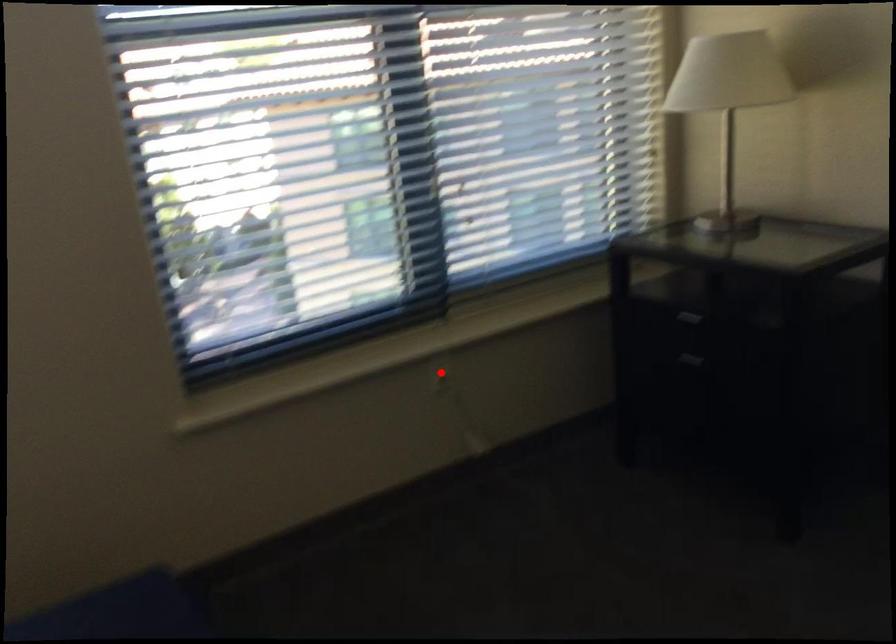
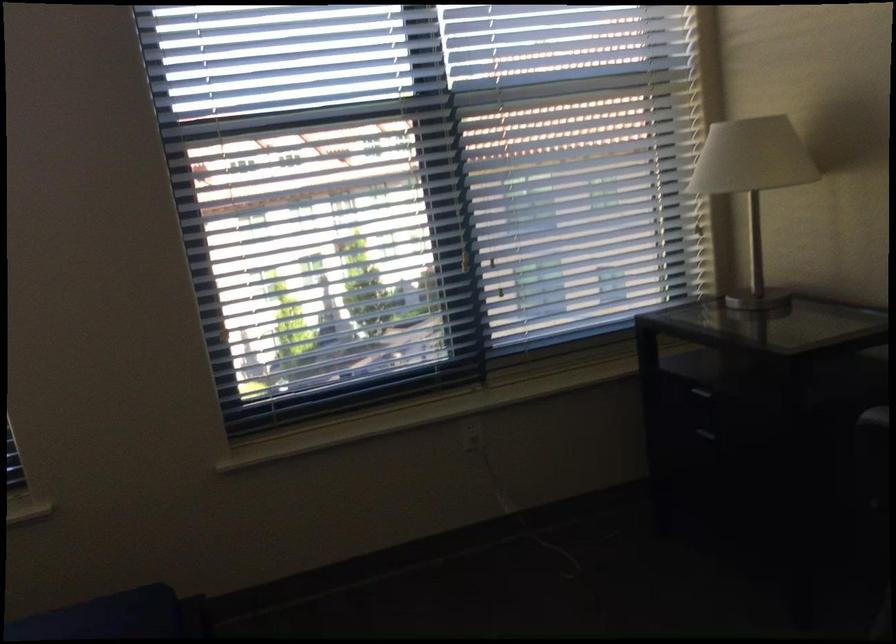
Where in the second image is the point corresponding to the highlighted location from the first image?

(471, 433)